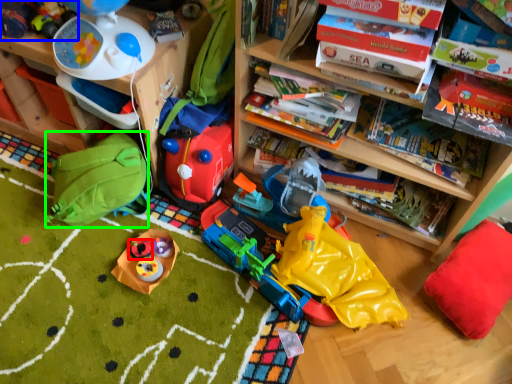
Question: Estimate the real-world distances between objects in this image. Which object is farther from toy (highlighted by a red box), toy (highlighted by a blue box) or backpack (highlighted by a green box)?

Choices:
 (A) toy
 (B) backpack

Answer: (A)